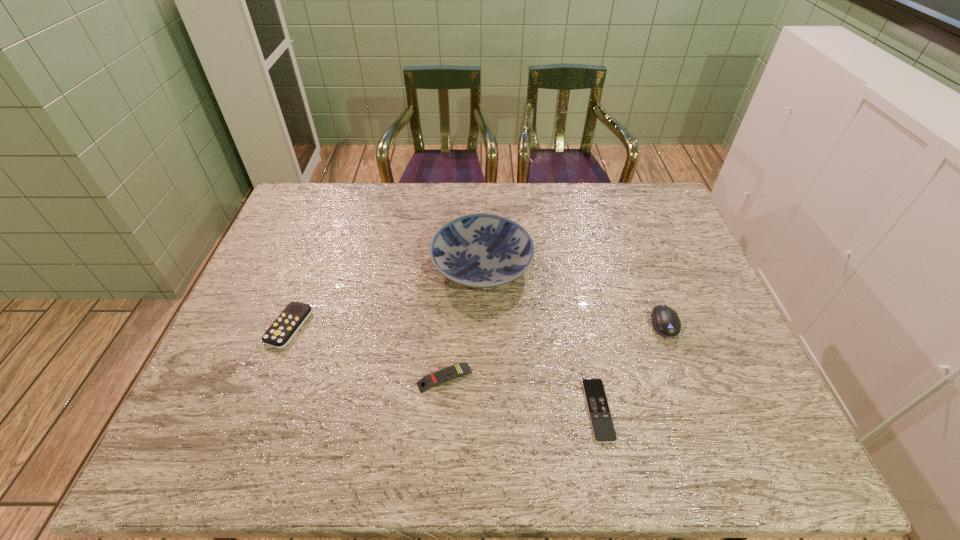
The height and width of the screenshot is (540, 960). What are the coordinates of `the farthest object` in the screenshot? It's located at (480, 250).

You are a GUI agent. You are given a task and a screenshot of the screen. Output one action in this format:
    pyautogui.click(x=<x>, y=<y>)
    Task: Click on the plate
    This screenshot has height=540, width=960.
    Given the screenshot: What is the action you would take?
    pyautogui.click(x=480, y=250)

Identify the location of the fourth shortest object. This screenshot has width=960, height=540. pos(666,322).

The width and height of the screenshot is (960, 540). What are the coordinates of `computer mouse` in the screenshot? It's located at (666, 322).

Where is `the leftmost remote control`? Image resolution: width=960 pixels, height=540 pixels. the leftmost remote control is located at coordinates (280, 333).

The image size is (960, 540). I want to click on the leftmost object, so click(280, 333).

I want to click on the second shortest remote control, so click(449, 373).

Image resolution: width=960 pixels, height=540 pixels. In order to click on the second remote control from right to left in this screenshot , I will do `click(449, 373)`.

I want to click on the rightmost remote control, so click(603, 429).

Locate an element on the screen. The width and height of the screenshot is (960, 540). the fourth object from left to right is located at coordinates (603, 429).